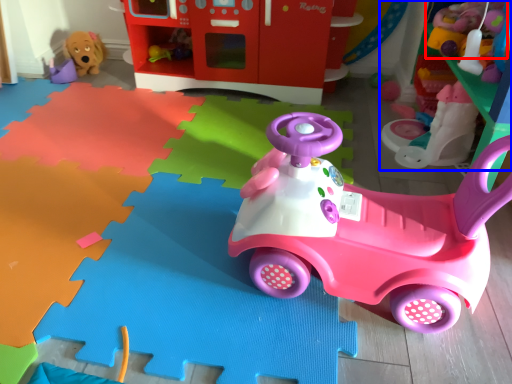
Question: Which of the following is the closest to the observer, toy (highlighted by a red box) or toy (highlighted by a blue box)?

Choices:
 (A) toy
 (B) toy

Answer: (A)